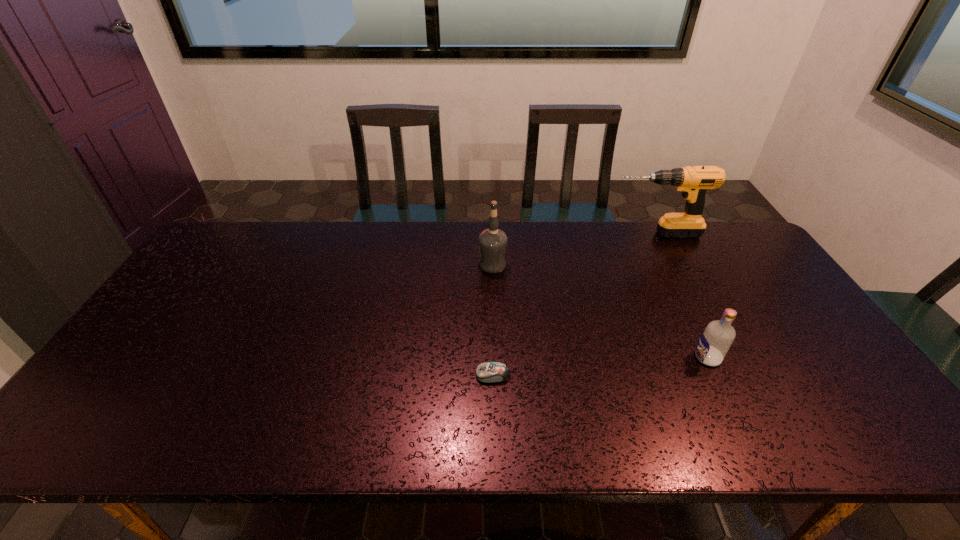
Locate an element on the screen. vacant point located between the computer mouse and the drill is located at coordinates (574, 304).

The width and height of the screenshot is (960, 540). I want to click on free space between the left vodka and the computer mouse, so click(492, 320).

You are a GUI agent. You are given a task and a screenshot of the screen. Output one action in this format:
    pyautogui.click(x=<x>, y=<y>)
    Task: Click on the vacant space in between the left vodka and the drill
    
    Given the screenshot: What is the action you would take?
    pyautogui.click(x=574, y=249)

What are the coordinates of `vacant point located between the farthest object and the computer mouse` in the screenshot? It's located at (574, 304).

Locate an element on the screen. The height and width of the screenshot is (540, 960). vacant area between the third nearest object and the computer mouse is located at coordinates (492, 320).

The image size is (960, 540). I want to click on empty space that is in between the computer mouse and the farthest object, so click(x=574, y=304).

Find the location of a particular element. The height and width of the screenshot is (540, 960). free area in between the computer mouse and the taller vodka is located at coordinates pyautogui.click(x=492, y=320).

The height and width of the screenshot is (540, 960). Identify the location of empty space that is in between the computer mouse and the left vodka. (492, 320).

The height and width of the screenshot is (540, 960). Identify the location of the closest object relative to the nearer vodka. (488, 372).

Identify which object is located as the third nearest to the computer mouse. Please provide its 2D coordinates. Your answer should be formatted as a tuple, i.e. [(x, y)], where the tuple contains the x and y coordinates of a point satisfying the conditions above.

[(694, 181)]